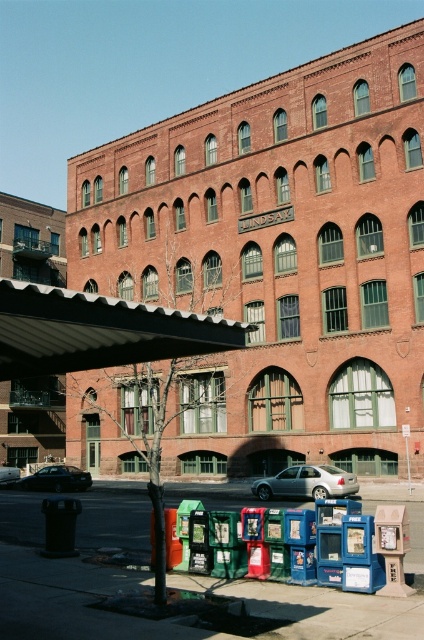
Can you confirm if white corrugated awning at center is wider than silver metallic sedan at center?

Indeed, white corrugated awning at center has a greater width compared to silver metallic sedan at center.

Between white corrugated awning at center and silver metallic sedan at center, which one is positioned lower?

silver metallic sedan at center

You are a GUI agent. You are given a task and a screenshot of the screen. Output one action in this format:
    pyautogui.click(x=<x>, y=<y>)
    Task: Click on the white corrugated awning at center
    Image resolution: width=424 pixels, height=640 pixels.
    Given the screenshot: What is the action you would take?
    pyautogui.click(x=97, y=332)

Can you confirm if white corrugated awning at center is positioned to the right of shiny black sedan at center?

Correct, you'll find white corrugated awning at center to the right of shiny black sedan at center.

Is point (151, 312) closer to viewer compared to point (86, 472)?

Yes, it is.

I want to click on white corrugated awning at center, so click(97, 332).

Is silver metallic sedan at center wider than shiny black sedan at center?

Incorrect, silver metallic sedan at center's width does not surpass shiny black sedan at center's.

Measure the distance from silver metallic sedan at center to shiny black sedan at center.

silver metallic sedan at center and shiny black sedan at center are 14.91 meters apart.

I want to click on silver metallic sedan at center, so [306, 483].